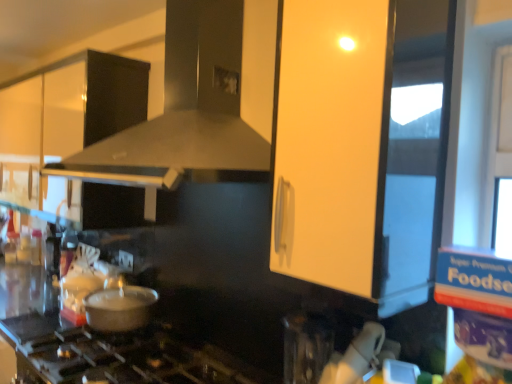
Question: Choose the correct answer: Is matte white cabinet at upper center inside white glossy cabinet at upper left or outside it?

Choices:
 (A) inside
 (B) outside

Answer: (B)

Question: From the image's perspective, is matte white cabinet at upper center located above or below white glossy cabinet at upper left?

Choices:
 (A) below
 (B) above

Answer: (A)

Question: Estimate the real-world distances between objects in this image. Which object is farther from the matte black vent at center?

Choices:
 (A) matte white cabinet at upper center
 (B) white glossy cabinet at upper left
 (C) black matte gas stove at lower center
 (D) metallic silver pot at lower left

Answer: (C)

Question: Which object is positioned closest to the black matte gas stove at lower center?

Choices:
 (A) matte black vent at center
 (B) metallic silver pot at lower left
 (C) matte white cabinet at upper center
 (D) white glossy cabinet at upper left

Answer: (B)